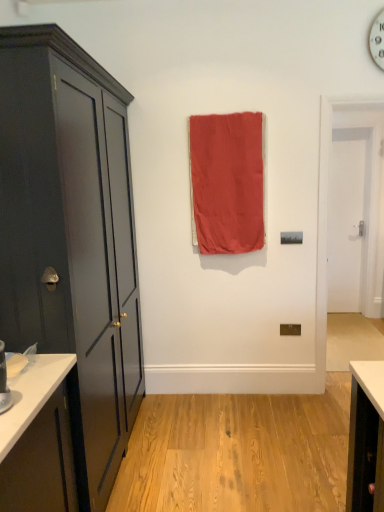
Question: Are coral fabric curtain at center and white smooth door at right far apart?

Choices:
 (A) yes
 (B) no

Answer: (A)

Question: Are coral fabric curtain at center and white smooth door at right making contact?

Choices:
 (A) no
 (B) yes

Answer: (A)

Question: Is coral fabric curtain at center facing away from white smooth door at right?

Choices:
 (A) yes
 (B) no

Answer: (B)

Question: Is coral fabric curtain at center shorter than white smooth door at right?

Choices:
 (A) no
 (B) yes

Answer: (B)

Question: Could you tell me if coral fabric curtain at center is facing white smooth door at right?

Choices:
 (A) no
 (B) yes

Answer: (A)

Question: Is coral fabric curtain at center to the left of white smooth door at right from the viewer's perspective?

Choices:
 (A) yes
 (B) no

Answer: (A)

Question: Is matte dark gray cabinet at left bigger than coral fabric curtain at center?

Choices:
 (A) yes
 (B) no

Answer: (A)

Question: Considering the relative sizes of matte dark gray cabinet at left and coral fabric curtain at center in the image provided, is matte dark gray cabinet at left shorter than coral fabric curtain at center?

Choices:
 (A) yes
 (B) no

Answer: (B)

Question: Are matte dark gray cabinet at left and coral fabric curtain at center far apart?

Choices:
 (A) no
 (B) yes

Answer: (A)

Question: Is matte dark gray cabinet at left placed right next to coral fabric curtain at center?

Choices:
 (A) yes
 (B) no

Answer: (B)

Question: Is matte dark gray cabinet at left to the right of coral fabric curtain at center from the viewer's perspective?

Choices:
 (A) no
 (B) yes

Answer: (A)

Question: Considering the relative sizes of matte dark gray cabinet at left and coral fabric curtain at center in the image provided, is matte dark gray cabinet at left smaller than coral fabric curtain at center?

Choices:
 (A) yes
 (B) no

Answer: (B)

Question: Is matte dark gray cabinet at left thinner than white smooth door at right?

Choices:
 (A) no
 (B) yes

Answer: (A)